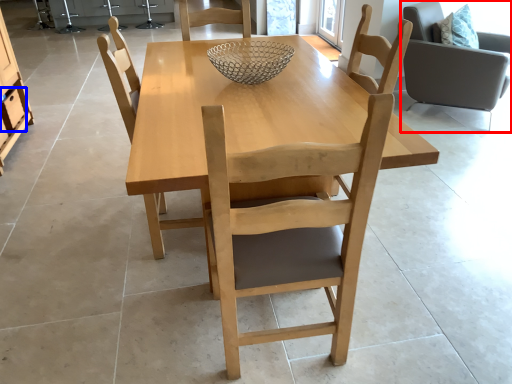
Question: Which object appears farthest to the camera in this image, chair (highlighted by a red box) or drawer (highlighted by a blue box)?

Choices:
 (A) chair
 (B) drawer

Answer: (B)